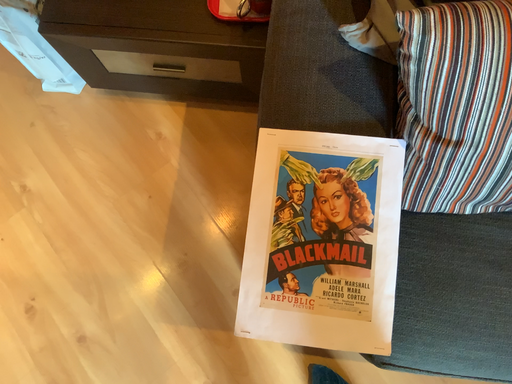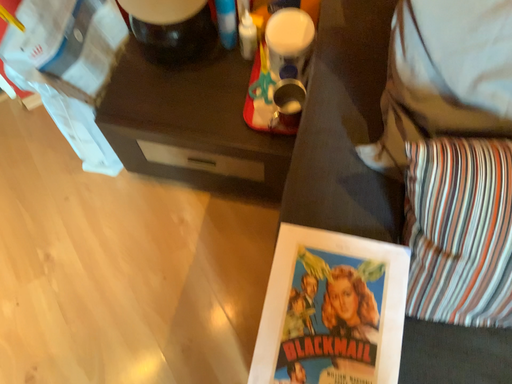
Question: How did the camera likely rotate when shooting the video?

Choices:
 (A) rotated downward
 (B) rotated upward

Answer: (B)